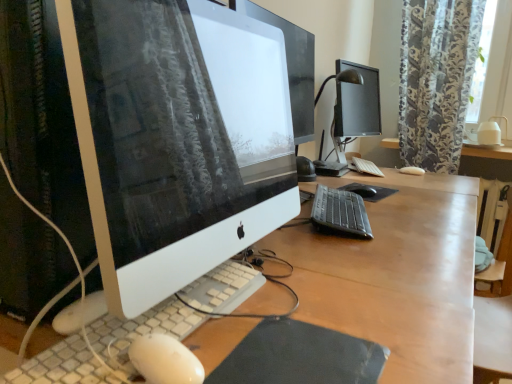
This screenshot has height=384, width=512. Find the location of `vacant area that is situated to the right of black matte mouse at center`. vacant area that is situated to the right of black matte mouse at center is located at coordinates (411, 198).